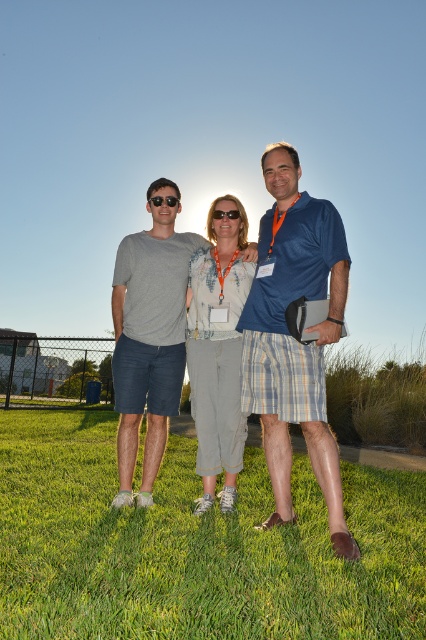
The image size is (426, 640). What do you see at coordinates (195, 547) in the screenshot? I see `green grass at center` at bounding box center [195, 547].

Between green grass at center and transparent plastic goggles at center, which one has less height?

transparent plastic goggles at center is shorter.

Image resolution: width=426 pixels, height=640 pixels. What do you see at coordinates (195, 547) in the screenshot?
I see `green grass at center` at bounding box center [195, 547].

Identify the location of green grass at center. The image size is (426, 640). (195, 547).

Who is more distant from viewer, (294, 248) or (259, 385)?

Positioned behind is point (259, 385).

Does point (273, 461) come in front of point (287, 237)?

That is False.

Identify the location of matte gray t-shirt at center. This screenshot has height=640, width=426. (296, 337).

Does blue silk shirt at center have a lesser height compared to gray cotton t-shirt at center?

Incorrect, blue silk shirt at center's height does not fall short of gray cotton t-shirt at center's.

Between blue silk shirt at center and gray cotton t-shirt at center, which one has less height?

gray cotton t-shirt at center

Find the location of a particular element. This screenshot has width=426, height=640. blue silk shirt at center is located at coordinates (294, 339).